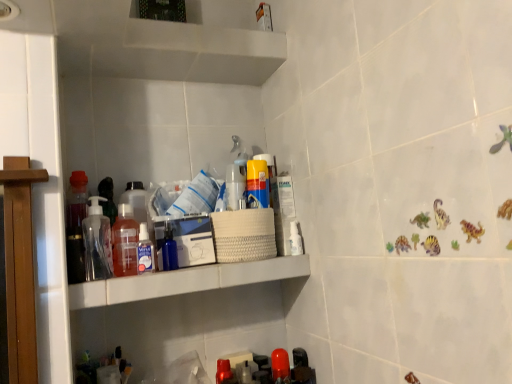
Question: Choose the correct answer: Is white plastic shelf at upper center inside translucent plastic pump bottle at left, the 3th bottle when ordered from right to left, or outside it?

Choices:
 (A) outside
 (B) inside

Answer: (A)

Question: Is white plastic shelf at upper center bigger or smaller than translucent plastic pump bottle at left, the 3th bottle when ordered from right to left?

Choices:
 (A) small
 (B) big

Answer: (B)

Question: Estimate the real-world distances between objects in this image. Which object is closer to the transparent plastic spray bottle at upper center, the 1th toiletry positioned from the front?

Choices:
 (A) translucent plastic pump bottle at left, the 3th bottle when ordered from right to left
 (B) transparent plastic bottle at left, the fourth bottle from the right
 (C) white plastic bottle at upper right, which is the first toiletry from right to left
 (D) white plastic shelf at upper center
 (E) translucent plastic bottle at center, the second bottle positioned from the right

Answer: (E)

Question: Estimate the real-world distances between objects in this image. Which object is closer to the white plastic shelf at upper center?

Choices:
 (A) matte plastic can at center, the second toiletry when ordered from right to left
 (B) translucent plastic pump bottle at left, the 2th bottle viewed from the left
 (C) transparent plastic bottle at left, marked as the first bottle in a left-to-right arrangement
 (D) white plastic bottle at upper right, the first toiletry when ordered from back to front
 (E) transparent plastic spray bottle at upper center, positioned as the 3th toiletry in back-to-front order

Answer: (E)